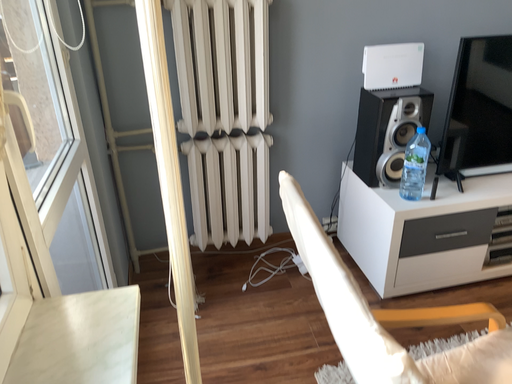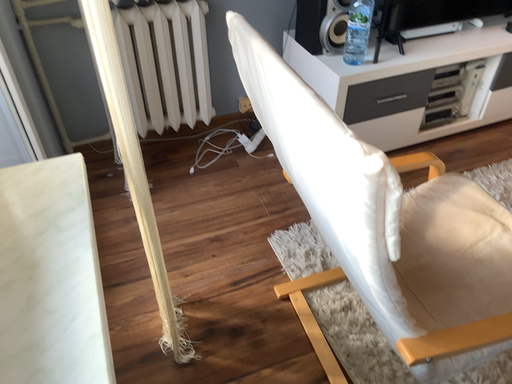
Question: How did the camera likely rotate when shooting the video?

Choices:
 (A) rotated downward
 (B) rotated upward

Answer: (A)